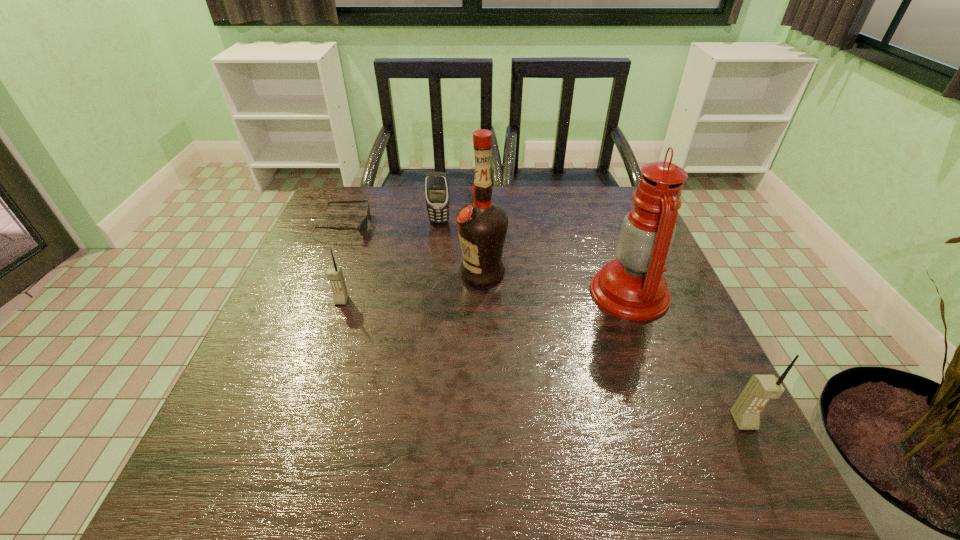
Please point a spot to place another cellular_telephone for symmetrical spacing. Please provide its 2D coordinates. Your answer should be formatted as a tuple, i.e. [(x, y)], where the tuple contains the x and y coordinates of a point satisfying the conditions above.

[(516, 353)]